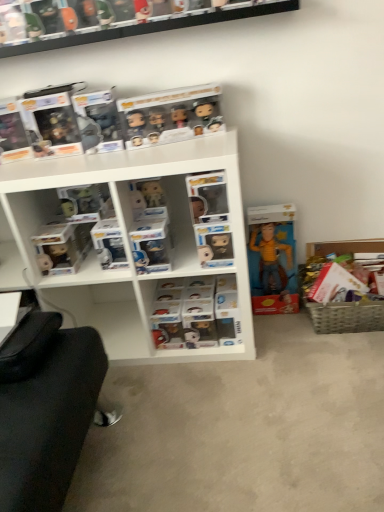
Identify the location of vacant area that is in front of yellow fabric doll at center, the first toy positioned from the right. (292, 328).